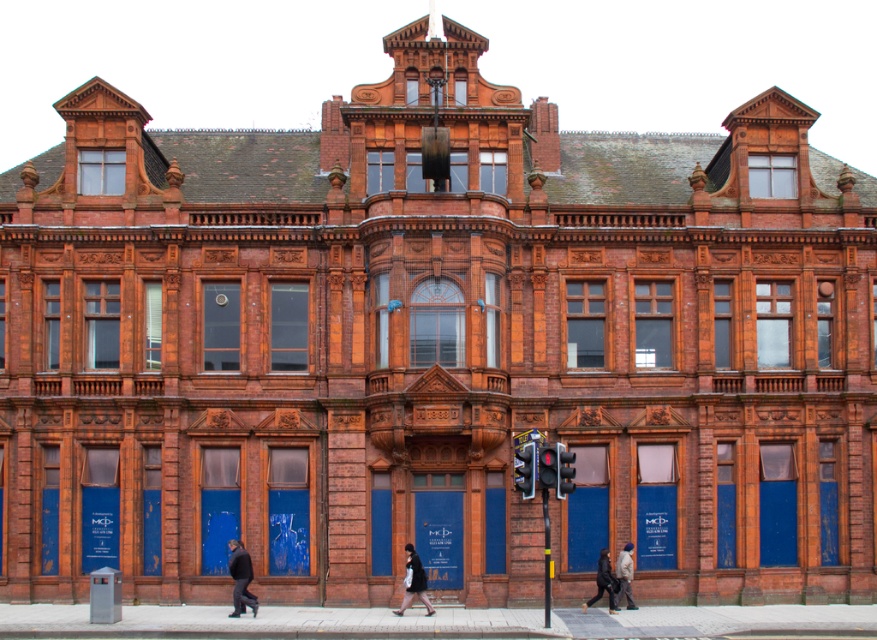
Question: Where is black fabric coat at center located in relation to dark gray woolen jacket at lower center in the image?

Choices:
 (A) left
 (B) right

Answer: (A)

Question: Is black fabric coat at center thinner than dark gray fabric coat at lower center?

Choices:
 (A) yes
 (B) no

Answer: (B)

Question: Observing the image, what is the correct spatial positioning of dark gray fabric jacket at lower left in reference to dark gray fabric coat at lower center?

Choices:
 (A) left
 (B) right

Answer: (A)

Question: Which object is the farthest from the black fabric coat at center?

Choices:
 (A) dark gray fabric coat at lower center
 (B) dark gray woolen jacket at lower center
 (C) dark gray fabric jacket at lower left

Answer: (B)

Question: Which point is closer to the camera?

Choices:
 (A) (628, 602)
 (B) (237, 576)
 (C) (607, 556)
 (D) (408, 563)

Answer: (B)

Question: Which object appears farthest from the camera in this image?

Choices:
 (A) dark gray woolen jacket at lower center
 (B) dark gray fabric jacket at lower left
 (C) black fabric coat at center
 (D) dark gray fabric coat at lower center

Answer: (A)